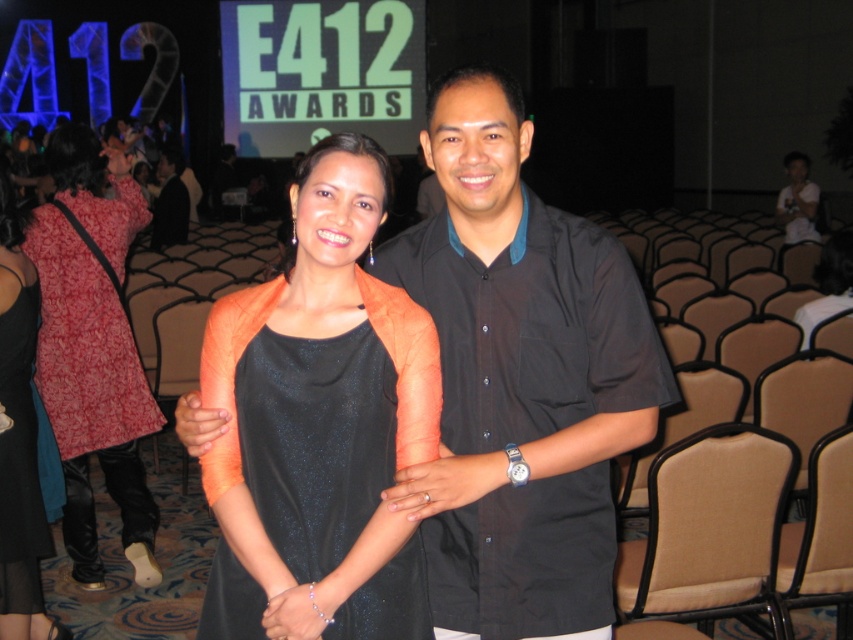
You are a photographer at the E412 Awards event. You need to focus your camera on the black glittery dress at center. What are the coordinates where you should aim your camera?

The coordinates for the black glittery dress at center are at point (316,440).

You are standing at the event and want to take a photo with the person wearing the black glittery dress at center. If you are currently 5.89 feet away from them, is that within a comfortable social distance for taking photos?

The distance between you and the black glittery dress at center is exactly 5.89 feet, which is considered a comfortable social distance for taking photos, so yes, you can take the photo from there.

You are a photographer at the E412 Awards event. You need to capture a photo of the two guests wearing the black glittery dress at center and the printed cotton dress at left. Considering their dress lengths, which dress will require the photographer to adjust the camera angle to avoid showing too much leg?

The black glittery dress at center is shorter than the printed cotton dress at left, so the photographer should adjust the camera angle to avoid showing too much leg when photographing the guest in the black glittery dress at center.